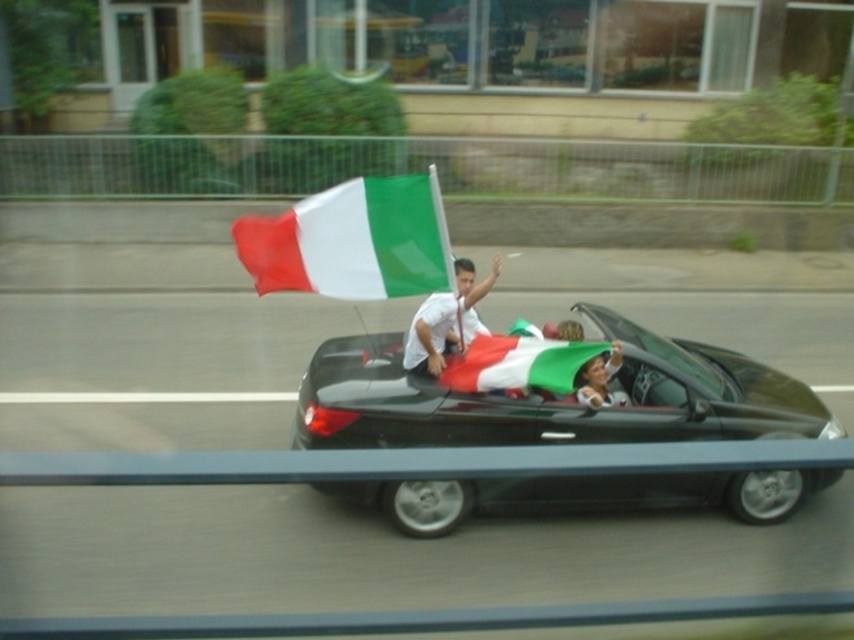
Does matte fabric flag at center have a larger size compared to green fabric flag at center?

Incorrect, matte fabric flag at center is not larger than green fabric flag at center.

Find the location of a particular element. matte fabric flag at center is located at coordinates (354, 241).

The height and width of the screenshot is (640, 854). I want to click on matte fabric flag at center, so click(354, 241).

Does green fabric flag at center appear on the left side of matte white shirt at center?

Indeed, green fabric flag at center is positioned on the left side of matte white shirt at center.

Is green fabric flag at center further to the viewer compared to matte white shirt at center?

No, green fabric flag at center is in front of matte white shirt at center.

The height and width of the screenshot is (640, 854). I want to click on green fabric flag at center, so click(518, 364).

Find the location of a particular element. This screenshot has height=640, width=854. green fabric flag at center is located at coordinates (518, 364).

Measure the distance between point (478, 355) and camera.

They are 6.40 meters apart.

Who is more distant from viewer, [451,380] or [465,289]?

The point [465,289] is behind.

Identify the location of green fabric flag at center. (518, 364).